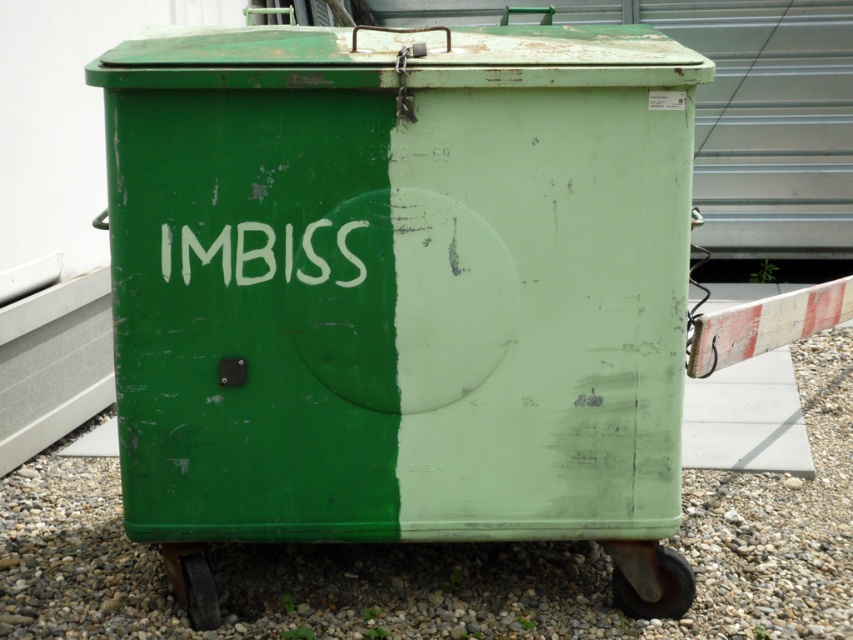
Question: Which object is farther from the camera taking this photo?

Choices:
 (A) white painted text at center
 (B) green gravel at lower center
 (C) rubber/rough wheel at lower right
 (D) metallic gray wheel at lower left

Answer: (C)

Question: Can you confirm if white painted text at center is positioned to the left of rubber/rough wheel at lower right?

Choices:
 (A) yes
 (B) no

Answer: (A)

Question: Can you confirm if green matte container at center is positioned to the left of green gravel at lower center?

Choices:
 (A) no
 (B) yes

Answer: (A)

Question: Which object is closer to the camera taking this photo?

Choices:
 (A) green gravel at lower center
 (B) green matte container at center

Answer: (B)

Question: Is green matte container at center further to the viewer compared to green gravel at lower center?

Choices:
 (A) yes
 (B) no

Answer: (B)

Question: Which point appears closest to the camera in this image?

Choices:
 (A) (637, 416)
 (B) (270, 561)
 (C) (659, 605)
 (D) (357, 275)

Answer: (D)